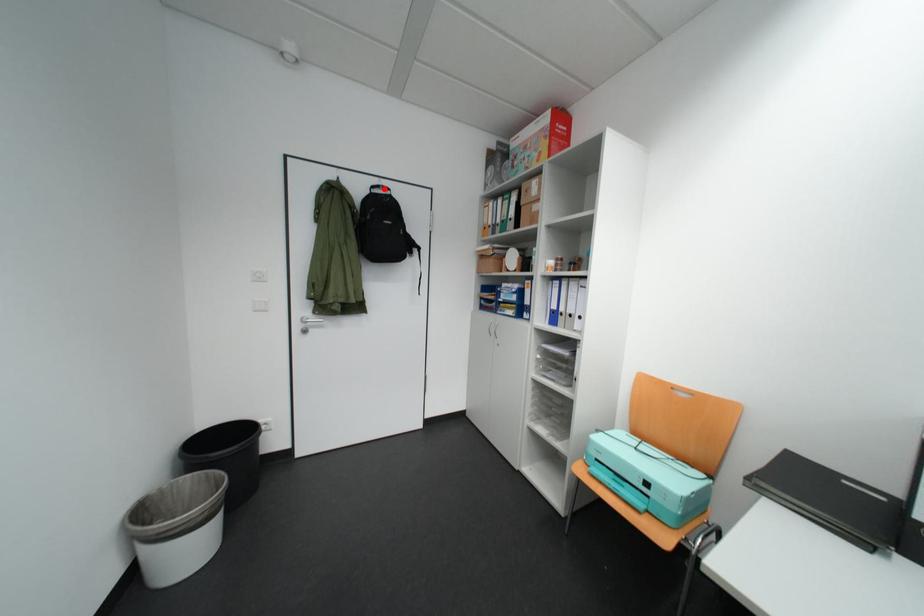
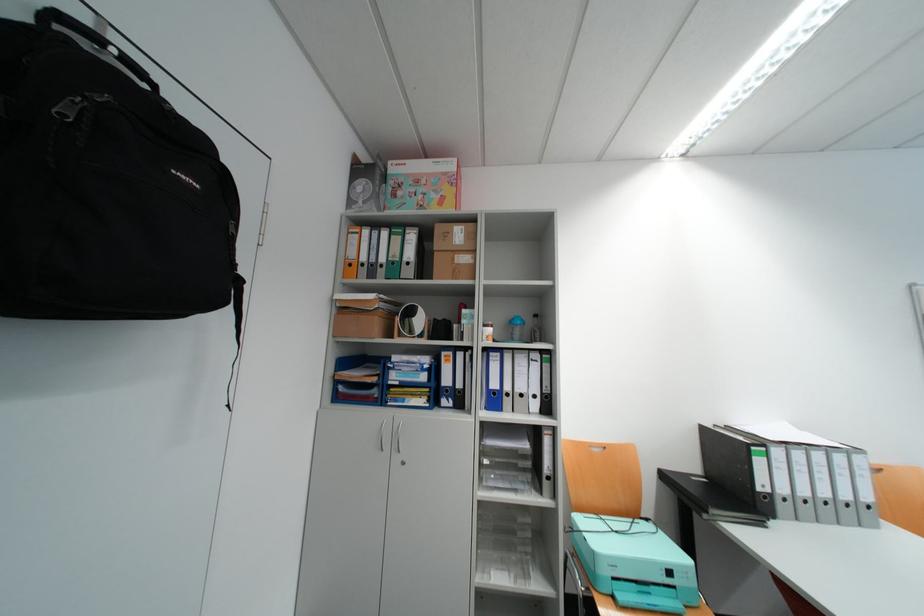
Question: I am providing you with two images of the same scene from different viewpoints. Given a red point in image1, look at the same physical point in image2. Is it:

Choices:
 (A) Closer to the viewpoint
 (B) Farther from the viewpoint

Answer: (B)